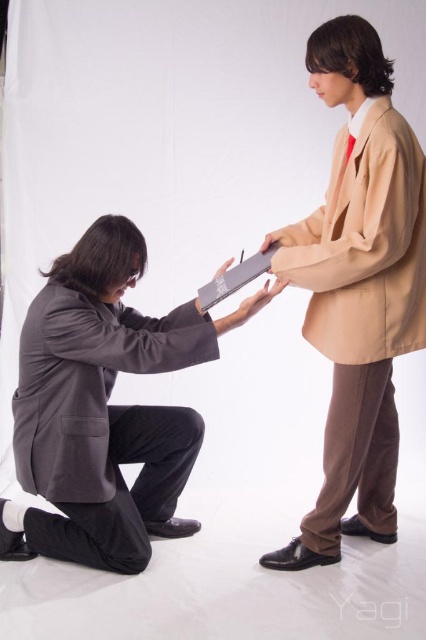
You are a photographer in a studio setting with a plain white backdrop. You need to adjust the lighting so that the dark gray wool business suit at lower left and the matte gray paper at center are both well lit. Given the distance between them, will you need to use a single light source or multiple light sources to ensure both are properly illuminated?

The distance between dark gray wool business suit at lower left and matte gray paper at center is 20.11 inches. Since the distance is relatively small, a single light source positioned appropriately can adequately illuminate both objects without needing multiple sources.